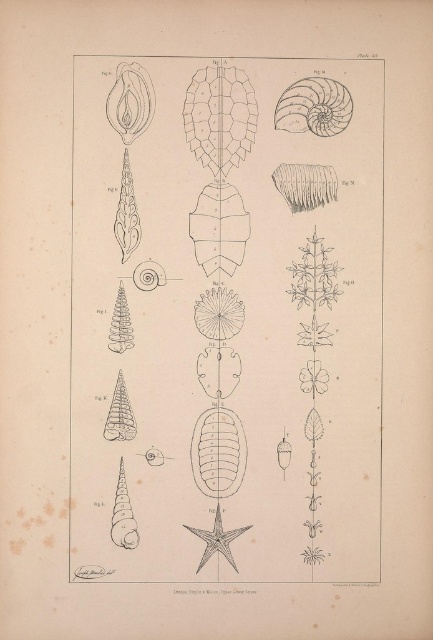
Question: Is gray line drawing of starfish at center behind matte gray shell at upper right?

Choices:
 (A) no
 (B) yes

Answer: (A)

Question: Which object appears closest to the camera in this image?

Choices:
 (A) matte gray shell at upper right
 (B) gray line drawing of starfish at center

Answer: (B)

Question: Which object is closer to the camera taking this photo?

Choices:
 (A) matte gray shell at upper right
 (B) gray line drawing of starfish at center

Answer: (B)

Question: Among these points, which one is nearest to the camera?

Choices:
 (A) coord(307,88)
 (B) coord(232,236)

Answer: (A)

Question: Where is gray line drawing of starfish at center located in relation to matte gray shell at upper right in the image?

Choices:
 (A) left
 (B) right

Answer: (A)

Question: Does gray line drawing of starfish at center appear on the left side of matte gray shell at upper right?

Choices:
 (A) yes
 (B) no

Answer: (A)